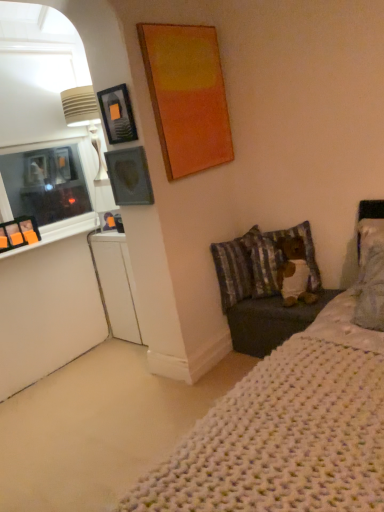
Question: Is striped fabric pillow at lower right, the second pillow positioned from the right, smaller than white glossy dresser at lower left?

Choices:
 (A) yes
 (B) no

Answer: (A)

Question: Is striped fabric pillow at lower right, marked as the first pillow in a left-to-right arrangement, placed right next to white glossy dresser at lower left?

Choices:
 (A) no
 (B) yes

Answer: (A)

Question: Is striped fabric pillow at lower right, the second pillow positioned from the right, taller than white glossy dresser at lower left?

Choices:
 (A) no
 (B) yes

Answer: (A)

Question: Can white glossy dresser at lower left be found inside striped fabric pillow at lower right, the second pillow positioned from the right?

Choices:
 (A) yes
 (B) no

Answer: (B)

Question: Is striped fabric pillow at lower right, marked as the first pillow in a left-to-right arrangement, facing away from white glossy dresser at lower left?

Choices:
 (A) no
 (B) yes

Answer: (B)

Question: From the image's perspective, is striped fabric pillow at lower right, marked as the first pillow in a left-to-right arrangement, located above or below fluffy fabric pillow at center-right, which is the 1th pillow from right to left?

Choices:
 (A) below
 (B) above

Answer: (B)

Question: Is striped fabric pillow at lower right, marked as the first pillow in a left-to-right arrangement, inside or outside of fluffy fabric pillow at center-right, which is the 2th pillow in left-to-right order?

Choices:
 (A) inside
 (B) outside

Answer: (B)

Question: In terms of size, does striped fabric pillow at lower right, the second pillow positioned from the right, appear bigger or smaller than fluffy fabric pillow at center-right, which is the 2th pillow in left-to-right order?

Choices:
 (A) big
 (B) small

Answer: (A)

Question: Based on their positions, is striped fabric pillow at lower right, marked as the first pillow in a left-to-right arrangement, located to the left or right of fluffy fabric pillow at center-right, which is the 2th pillow in left-to-right order?

Choices:
 (A) right
 (B) left

Answer: (B)

Question: Considering the relative positions of matte gray picture frame at upper left, acting as the second picture frame starting from the top, and matte black picture frame at upper left, the second picture frame positioned from the bottom, in the image provided, is matte gray picture frame at upper left, acting as the second picture frame starting from the top, to the left or to the right of matte black picture frame at upper left, the second picture frame positioned from the bottom,?

Choices:
 (A) left
 (B) right

Answer: (B)

Question: From a real-world perspective, is matte gray picture frame at upper left, acting as the second picture frame starting from the top, physically located above or below matte black picture frame at upper left, the second picture frame positioned from the bottom?

Choices:
 (A) below
 (B) above

Answer: (A)

Question: From the image's perspective, is matte gray picture frame at upper left, acting as the second picture frame starting from the top, above or below matte black picture frame at upper left, the second picture frame positioned from the bottom?

Choices:
 (A) above
 (B) below

Answer: (B)

Question: Considering the positions of matte gray picture frame at upper left, the 1th picture frame positioned from the bottom, and matte black picture frame at upper left, positioned as the first picture frame in top-to-bottom order, in the image, is matte gray picture frame at upper left, the 1th picture frame positioned from the bottom, bigger or smaller than matte black picture frame at upper left, positioned as the first picture frame in top-to-bottom order,?

Choices:
 (A) big
 (B) small

Answer: (A)

Question: Is matte black picture frame at upper left, positioned as the first picture frame in top-to-bottom order, in front of or behind fluffy fabric pillow at center-right, which is the 1th pillow from right to left, in the image?

Choices:
 (A) front
 (B) behind

Answer: (A)

Question: From a real-world perspective, relative to fluffy fabric pillow at center-right, which is the 2th pillow in left-to-right order, is matte black picture frame at upper left, the second picture frame positioned from the bottom, vertically above or below?

Choices:
 (A) below
 (B) above

Answer: (B)